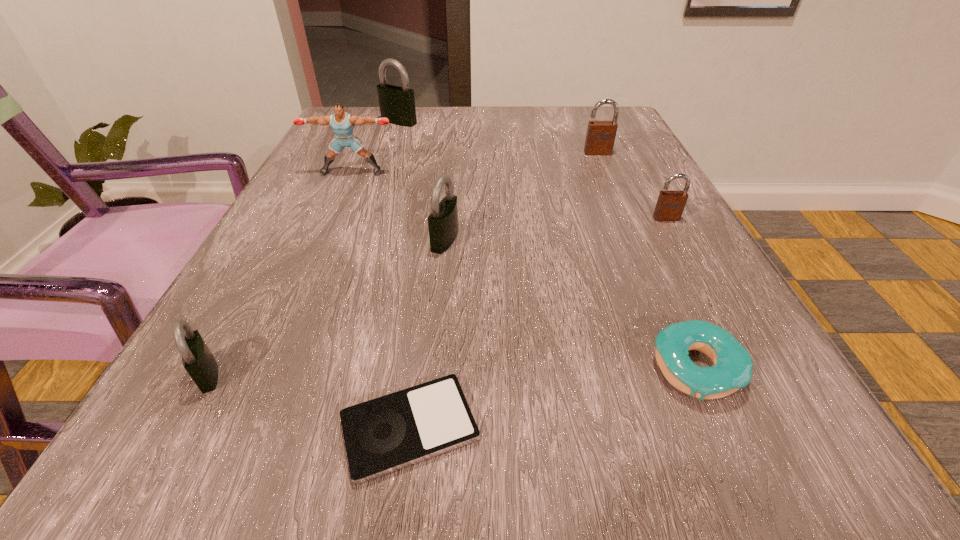
Identify the location of blank space located on the front-facing side of the right brown padlock. The width and height of the screenshot is (960, 540). (679, 241).

In order to click on vacant space located 0.190m on the left of the doughnut in this screenshot , I will do `click(500, 369)`.

Locate an element on the screen. This screenshot has height=540, width=960. vacant space located on the right of the gray iPod is located at coordinates (722, 428).

At what (x,y) coordinates should I click in order to perform the action: click on object that is positioned at the far edge. Please return your answer as a coordinate pair (x, y). This screenshot has height=540, width=960. Looking at the image, I should click on (397, 104).

Locate an element on the screen. object present at the near edge is located at coordinates (388, 433).

I want to click on puncher at the left edge, so click(x=342, y=123).

This screenshot has height=540, width=960. In order to click on doughnut located at the right edge in this screenshot , I will do `click(732, 370)`.

You are a GUI agent. You are given a task and a screenshot of the screen. Output one action in this format:
    pyautogui.click(x=<x>, y=<y>)
    Task: Click on the object that is positioned at the far left corner
    
    Given the screenshot: What is the action you would take?
    pyautogui.click(x=397, y=104)

At what (x,y) coordinates should I click in order to perform the action: click on vacant space at the far edge of the desktop. Please return your answer as a coordinate pair (x, y). Looking at the image, I should click on (555, 120).

Locate an element on the screen. This screenshot has height=540, width=960. vacant space at the near edge of the desktop is located at coordinates (539, 470).